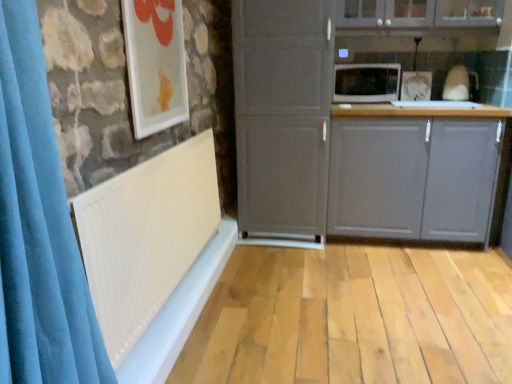
Locate an element on the screen. This screenshot has height=384, width=512. free space in front of matte gray cupboard at center is located at coordinates (290, 266).